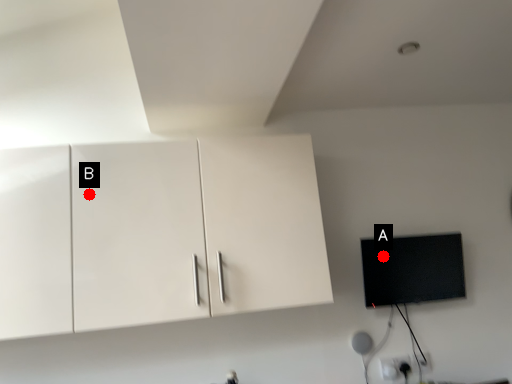
Question: Two points are circled on the image, labeled by A and B beside each circle. Which point is closer to the camera?

Choices:
 (A) A is closer
 (B) B is closer

Answer: (B)